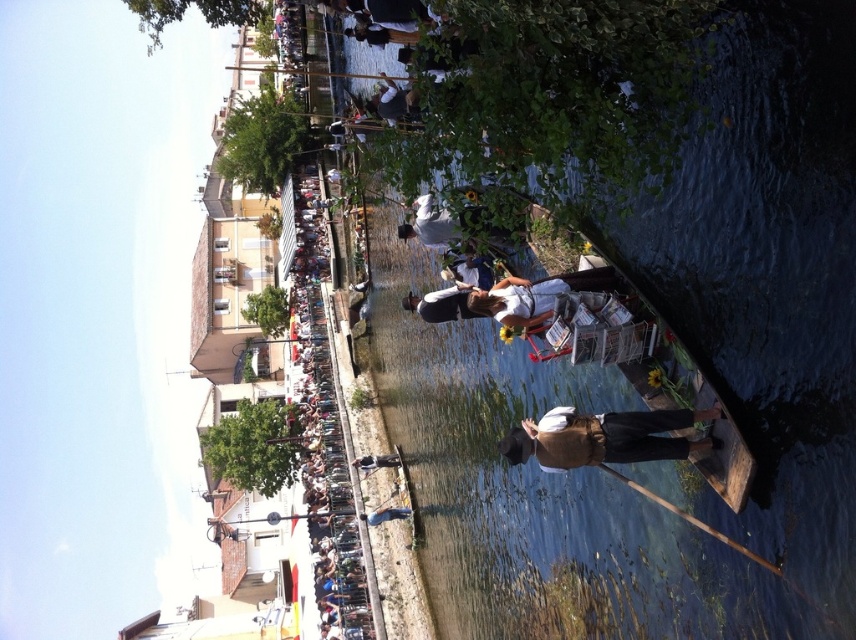
Question: Among these points, which one is nearest to the camera?

Choices:
 (A) (575, 497)
 (B) (663, 454)

Answer: (B)

Question: Which of the following is the closest to the observer?

Choices:
 (A) (596, 429)
 (B) (848, 324)

Answer: (B)

Question: Is clear blue water at center behind brown leather hat at center?

Choices:
 (A) yes
 (B) no

Answer: (B)

Question: Where is clear blue water at center located in relation to brown leather hat at center in the image?

Choices:
 (A) above
 (B) below

Answer: (B)

Question: Can you confirm if clear blue water at center is positioned below brown leather hat at center?

Choices:
 (A) yes
 (B) no

Answer: (A)